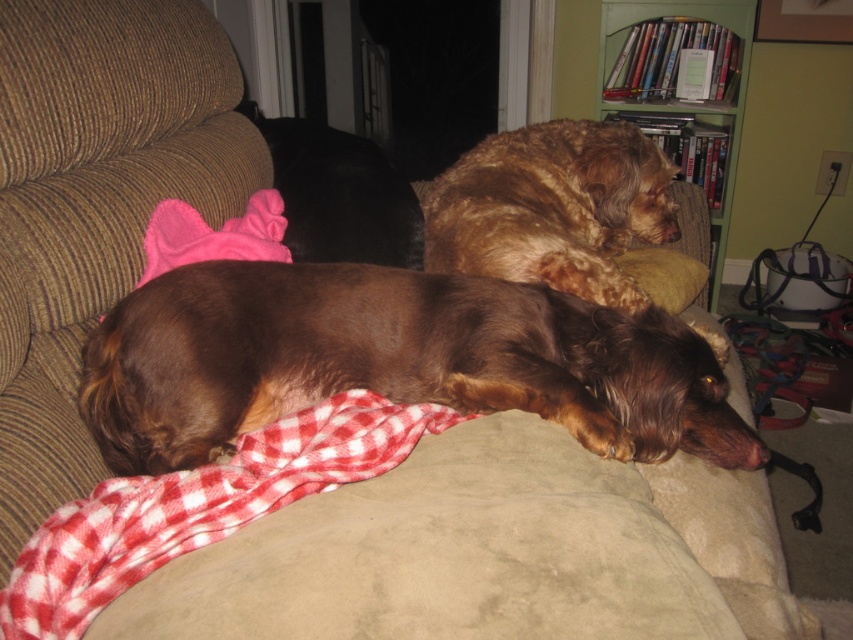
Question: Estimate the real-world distances between objects in this image. Which object is farther from the red checkered blanket at lower center?

Choices:
 (A) golden brown fur at upper right
 (B) brown shaggy dog at center
 (C) green wood bookshelf at upper right
 (D) brown fuzzy dog at upper left

Answer: (C)

Question: Can you confirm if brown shaggy dog at center is positioned above green wood bookshelf at upper right?

Choices:
 (A) no
 (B) yes

Answer: (A)

Question: Which object appears farthest from the camera in this image?

Choices:
 (A) red checkered blanket at lower center
 (B) green wood bookshelf at upper right

Answer: (B)

Question: Which of the following is the farthest from the observer?

Choices:
 (A) brown shaggy dog at center
 (B) green wood bookshelf at upper right
 (C) golden brown fur at upper right

Answer: (B)

Question: Where is brown shaggy dog at center located in relation to brown fuzzy dog at upper left in the image?

Choices:
 (A) above
 (B) below

Answer: (B)

Question: Can you confirm if brown shaggy dog at center is positioned to the right of golden brown fur at upper right?

Choices:
 (A) yes
 (B) no

Answer: (B)